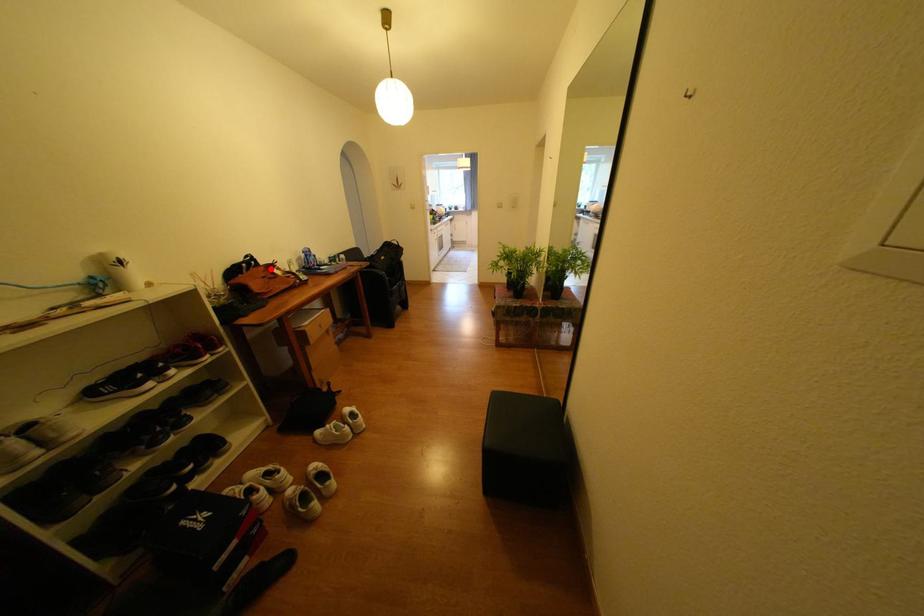
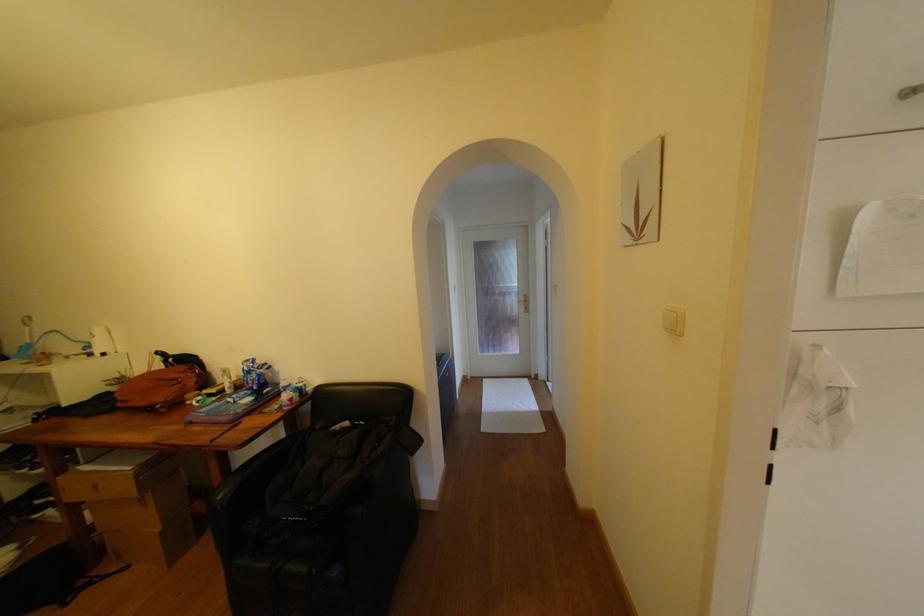
Where in the second image is the point corresponding to the highlighted location from the first image?

(190, 369)